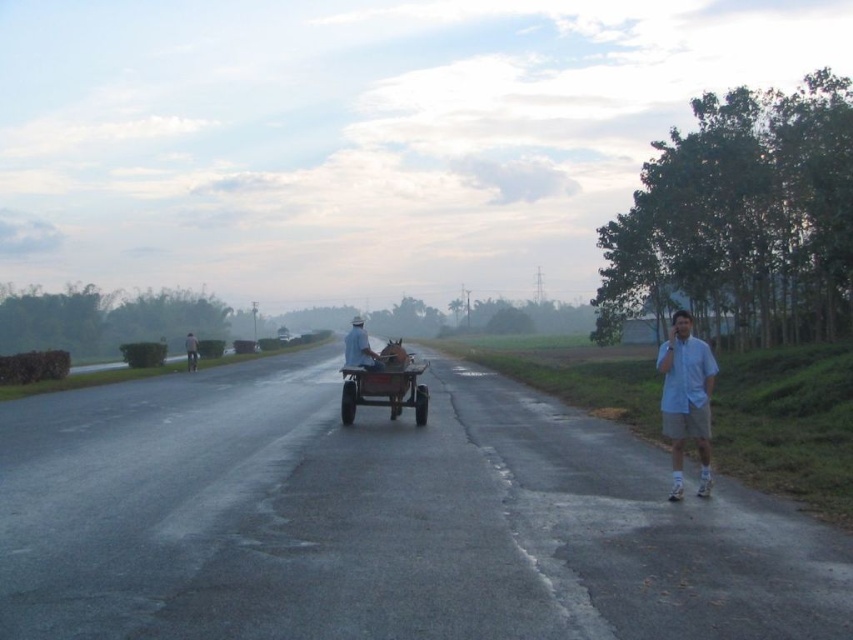
Is light blue shirt at right in front of brown wooden horse cart at center?

Yes, light blue shirt at right is in front of brown wooden horse cart at center.

Is light blue shirt at right taller than brown wooden horse cart at center?

Correct, light blue shirt at right is much taller as brown wooden horse cart at center.

Is point (685, 348) closer to camera compared to point (397, 352)?

Yes, point (685, 348) is in front of point (397, 352).

This screenshot has height=640, width=853. I want to click on light blue shirt at right, so click(686, 397).

Based on the photo, is brown wooden horse cart at center bigger than white cotton shirt at center?

No.

Is brown wooden horse cart at center above white cotton shirt at center?

Actually, brown wooden horse cart at center is below white cotton shirt at center.

I want to click on brown wooden horse cart at center, so click(386, 385).

Where is `brown wooden horse cart at center`? brown wooden horse cart at center is located at coordinates (386, 385).

Is light blue shirt at right wider than white fabric at center?

In fact, light blue shirt at right might be narrower than white fabric at center.

Who is positioned more to the right, light blue shirt at right or white fabric at center?

Positioned to the right is light blue shirt at right.

Where is `light blue shirt at right`? light blue shirt at right is located at coordinates (686, 397).